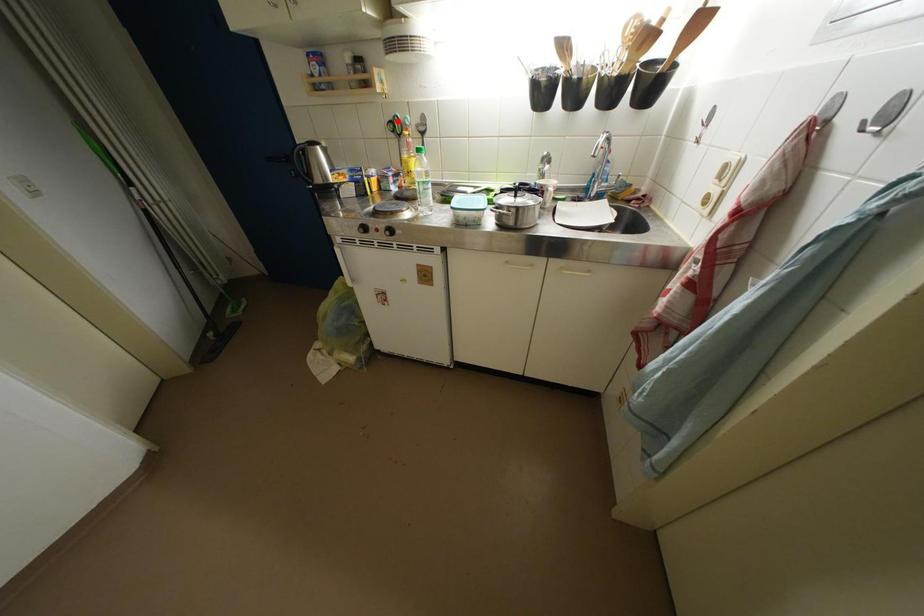
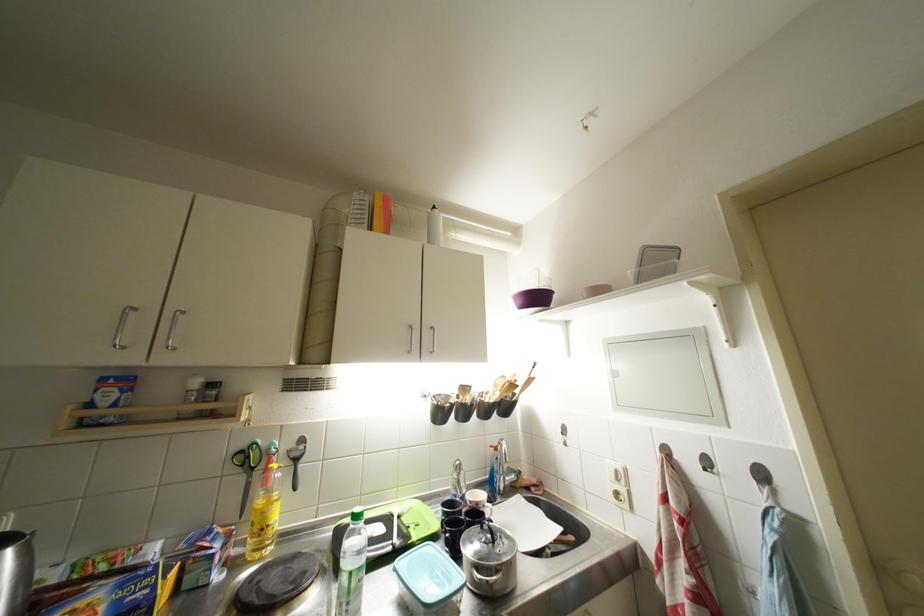
Locate, in the second image, the point that corresponds to the highlighted location in the first image.

(249, 450)